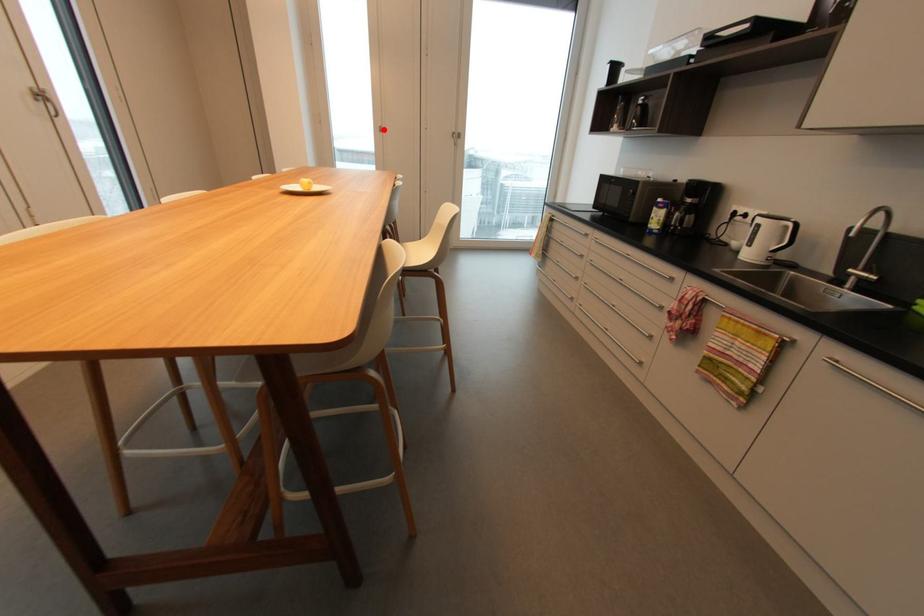
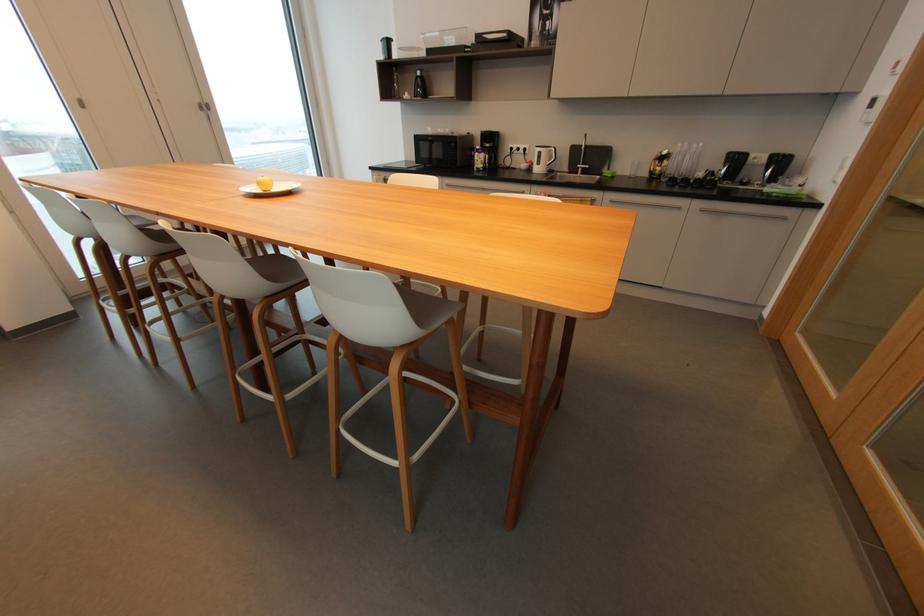
Where in the second image is the point corresponding to the highlighted location from the first image?

(81, 103)